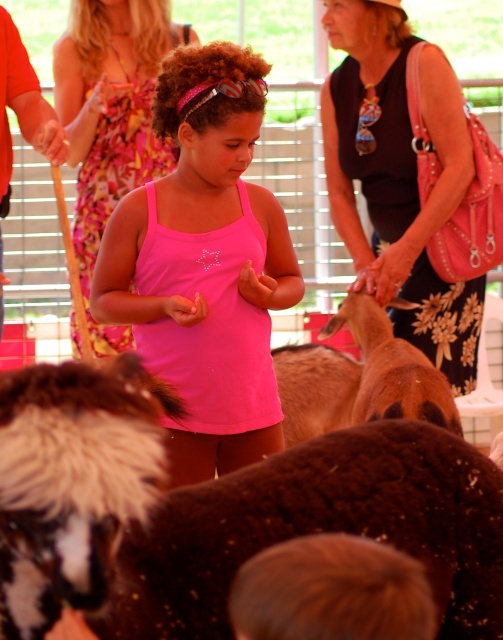
Does black floral dress at center appear over brown furry goat at center?

Indeed, black floral dress at center is positioned over brown furry goat at center.

Does black floral dress at center have a lesser height compared to brown furry goat at center?

In fact, black floral dress at center may be taller than brown furry goat at center.

The width and height of the screenshot is (503, 640). Identify the location of black floral dress at center. (398, 177).

Consider the image. Is pink matte tank top at center above brown furry goat at center?

Yes.

Who is taller, pink matte tank top at center or brown furry goat at center?

With more height is pink matte tank top at center.

Find the location of a particular element. The height and width of the screenshot is (640, 503). pink matte tank top at center is located at coordinates (205, 264).

Can you confirm if pink matte tank top at center is taller than pink fabric dress at center?

No, pink matte tank top at center is not taller than pink fabric dress at center.

Who is positioned more to the right, pink matte tank top at center or pink fabric dress at center?

pink matte tank top at center is more to the right.

Is point (187, 304) positioned before point (78, 96)?

Yes, it is.

At what (x,y) coordinates should I click in order to perform the action: click on pink matte tank top at center. Please return your answer as a coordinate pair (x, y). Image resolution: width=503 pixels, height=640 pixels. Looking at the image, I should click on (205, 264).